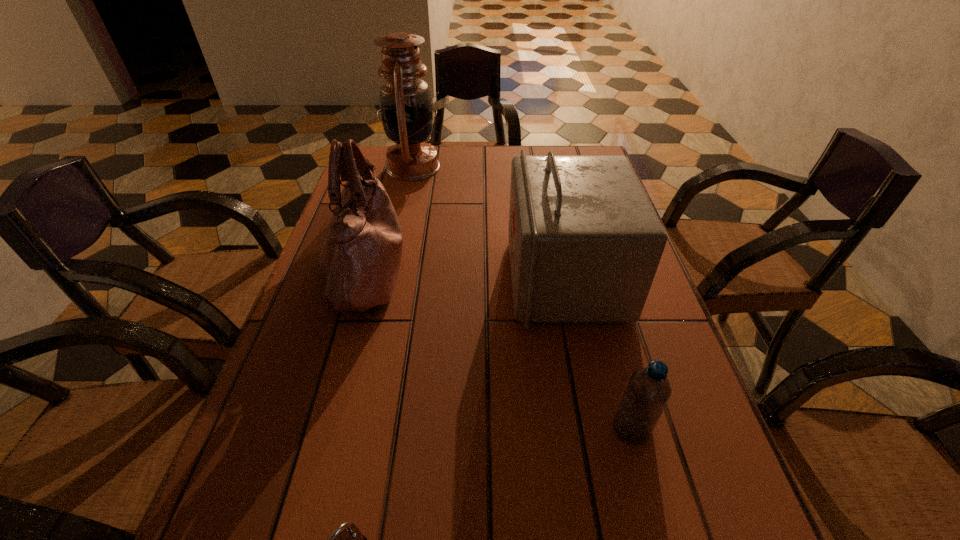
Locate an element on the screen. vacant space located 0.140m on the front-facing side of the first-aid kit is located at coordinates (450, 278).

Locate an element on the screen. This screenshot has height=540, width=960. free region located on the left of the water bottle is located at coordinates (454, 429).

This screenshot has height=540, width=960. I want to click on object that is at the far edge, so click(406, 109).

The height and width of the screenshot is (540, 960). Identify the location of oil lamp that is at the left edge. (406, 109).

In order to click on handbag positioned at the left edge in this screenshot , I will do `click(360, 258)`.

At what (x,y) coordinates should I click in order to perform the action: click on the first-aid kit located in the right edge section of the desktop. Please return your answer as a coordinate pair (x, y). This screenshot has width=960, height=540. Looking at the image, I should click on (585, 242).

Identify the location of water bottle present at the right edge. The image size is (960, 540). (648, 390).

This screenshot has width=960, height=540. In order to click on object at the far left corner in this screenshot , I will do (x=406, y=109).

In the image, there is a desktop. Where is `free space at the left edge`? free space at the left edge is located at coordinates (253, 459).

This screenshot has height=540, width=960. In order to click on vacant point at the right edge in this screenshot , I will do `click(721, 524)`.